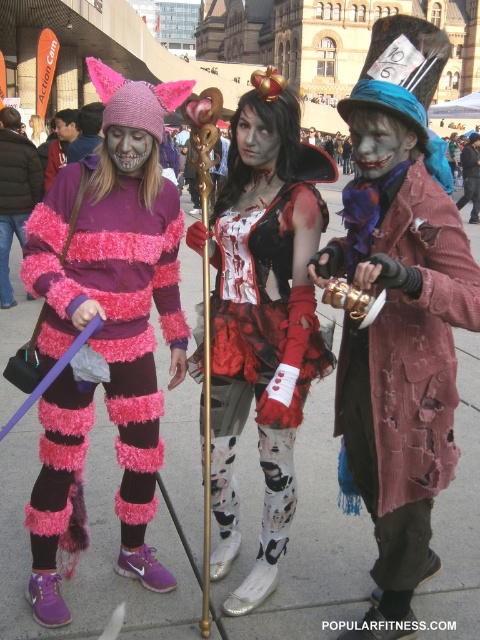
You are a photographer at the event and want to capture a wide shot of the rusty metal teapot at center and the fuzzy pink and purple striped sweater at left. Which object should you focus on to ensure both are in frame without needing to zoom in or out?

The rusty metal teapot at center has a smaller width than the fuzzy pink and purple striped sweater at left, so focusing on the larger object, the fuzzy pink and purple striped sweater at left, would allow both to be in frame without adjusting the zoom.

You are a photographer standing at the center of the event. You want to take a photo of the fuzzy pink and purple striped sweater at left and the other costume at right. How far apart are they?

The fuzzy pink and purple striped sweater at left and the other costume at right are 46.42 meters apart.

You are a photographer at the event and need to capture both the fuzzy pink and purple striped sweater at left and the matte black face paint at center in a single shot. Given that your camera can only focus on objects within a 3 meter height range, can both be included in the frame?

The fuzzy pink and purple striped sweater at left is taller than the matte black face paint at center. Since the camera can focus on objects within a 3 meter height range, both can be included as their height difference is within the range.